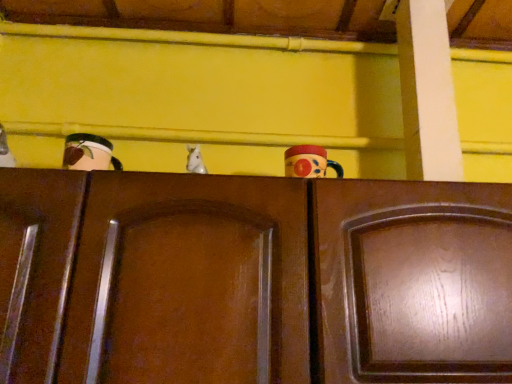
Question: Is there a large distance between wooden cabinet at center, placed as the first door when sorted from right to left, and glossy ceramic mug at upper center, the first toy when ordered from right to left?

Choices:
 (A) yes
 (B) no

Answer: (B)

Question: From a real-world perspective, is wooden cabinet at center, placed as the first door when sorted from right to left, physically below glossy ceramic mug at upper center, the first toy when ordered from right to left?

Choices:
 (A) yes
 (B) no

Answer: (A)

Question: Is wooden cabinet at center, the 2th door from the left, oriented away from glossy ceramic mug at upper center, the first toy when ordered from right to left?

Choices:
 (A) no
 (B) yes

Answer: (A)

Question: Can you confirm if wooden cabinet at center, the 2th door from the left, is thinner than glossy ceramic mug at upper center, which ranks as the second toy in left-to-right order?

Choices:
 (A) no
 (B) yes

Answer: (A)

Question: Is wooden cabinet at center, the 2th door from the left, outside glossy ceramic mug at upper center, which ranks as the second toy in left-to-right order?

Choices:
 (A) yes
 (B) no

Answer: (A)

Question: From the image's perspective, is wooden cabinet at center, placed as the first door when sorted from right to left, on top of glossy ceramic mug at upper center, which ranks as the second toy in left-to-right order?

Choices:
 (A) no
 (B) yes

Answer: (A)

Question: Does glossy wood door at center, the first door when ordered from left to right, lie in front of wooden cabinet at center, placed as the first door when sorted from right to left?

Choices:
 (A) yes
 (B) no

Answer: (A)

Question: Considering the relative sizes of glossy wood door at center, which is the 2th door from right to left, and wooden cabinet at center, the 2th door from the left, in the image provided, is glossy wood door at center, which is the 2th door from right to left, thinner than wooden cabinet at center, the 2th door from the left,?

Choices:
 (A) yes
 (B) no

Answer: (B)

Question: Is glossy wood door at center, which is the 2th door from right to left, not near wooden cabinet at center, the 2th door from the left?

Choices:
 (A) no
 (B) yes

Answer: (A)

Question: Considering the relative sizes of glossy wood door at center, the first door when ordered from left to right, and wooden cabinet at center, placed as the first door when sorted from right to left, in the image provided, is glossy wood door at center, the first door when ordered from left to right, shorter than wooden cabinet at center, placed as the first door when sorted from right to left,?

Choices:
 (A) yes
 (B) no

Answer: (B)

Question: Can you confirm if glossy wood door at center, which is the 2th door from right to left, is wider than wooden cabinet at center, placed as the first door when sorted from right to left?

Choices:
 (A) yes
 (B) no

Answer: (A)

Question: Does glossy wood door at center, the first door when ordered from left to right, appear on the right side of wooden cabinet at center, placed as the first door when sorted from right to left?

Choices:
 (A) no
 (B) yes

Answer: (A)

Question: Is glossy wood door at center, which is the 2th door from right to left, facing towards white glossy horse at center, placed as the 1th toy when sorted from left to right?

Choices:
 (A) no
 (B) yes

Answer: (A)